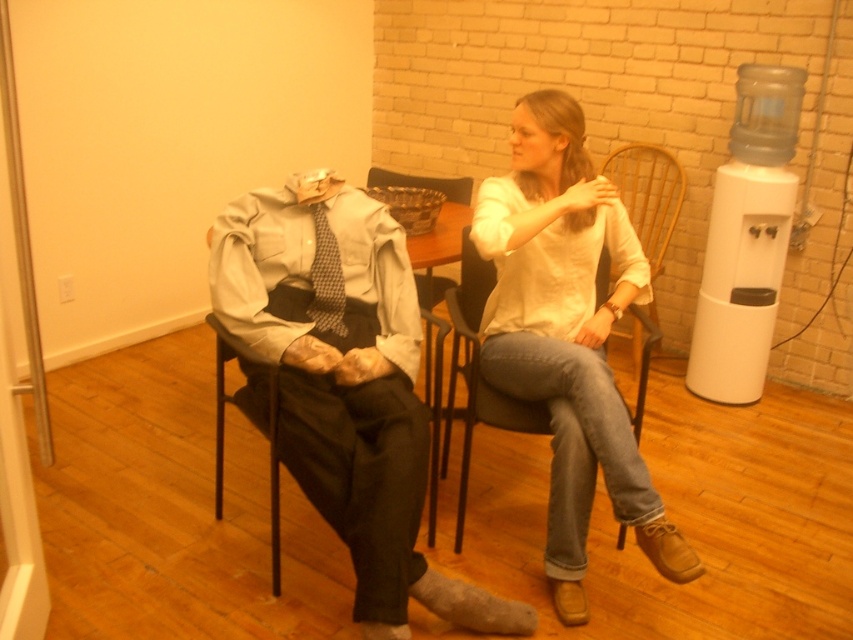
You are a tailor working in this room and need to check the placement of the matte gray suit at center and the white cotton shirt at center. According to the image, which item is positioned lower?

The matte gray suit at center is positioned lower than the white cotton shirt at center.

You are standing at the origin of the coordinate system in this room. There are two points marked in the scene, point A at point (419,336) and point B at point (317,272). Which point is further away from you?

Point A at point (419,336) is further away from you because it is behind point B at point (317,272).